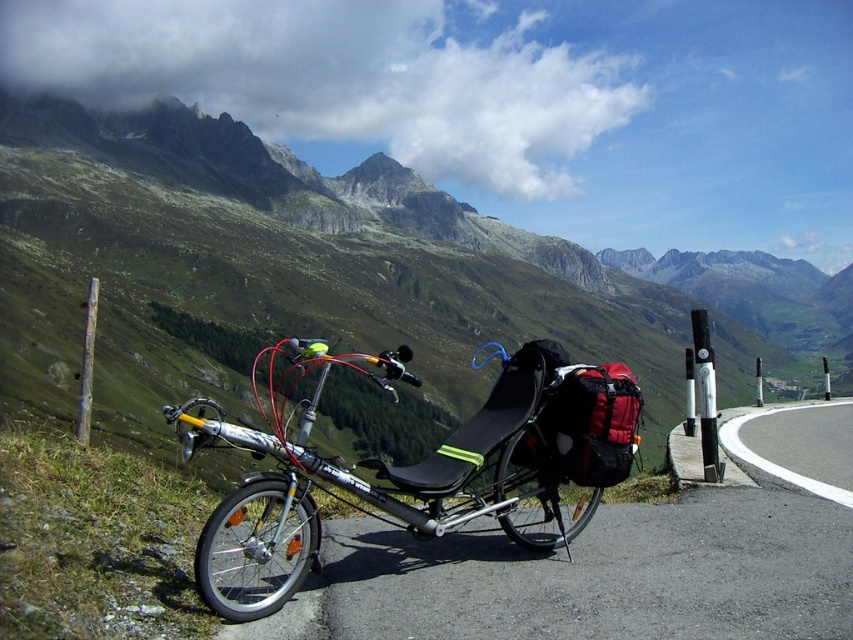
You are standing at the point with coordinates (776,465). What is located at this point?

The asphalt road at lower right is located at point (776,465).

You are a cyclist planning to ride along the asphalt road at lower right. You notice a wooden post at left near the edge of the road. Considering the road width, do you think there is enough space for a standard bicycle to pass safely without touching the wooden post?

The asphalt road at lower right is narrower than the wooden post at left, so there might not be enough space for a standard bicycle to pass safely without touching the wooden post.